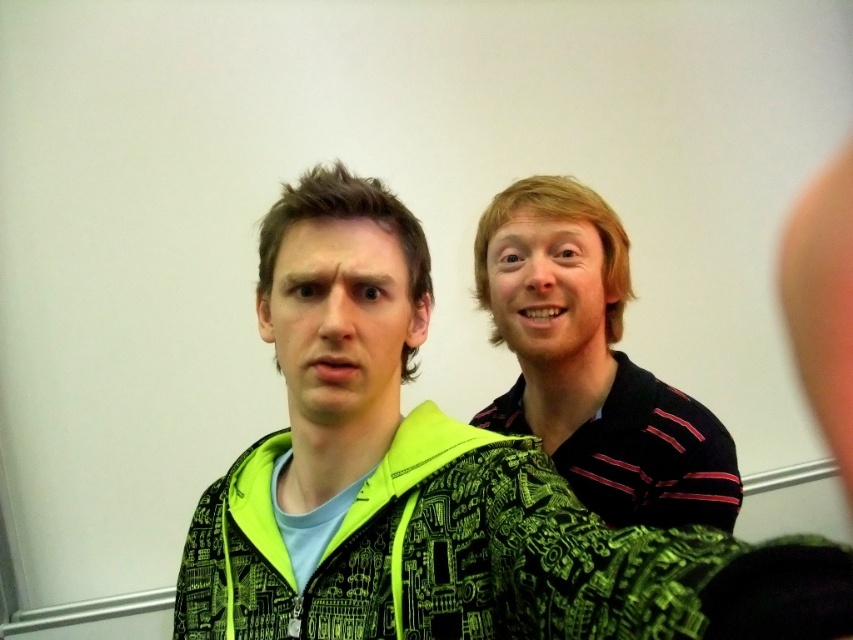
Can you confirm if striped cotton shirt at right is taller than smooth blonde hair at upper right?

Yes, striped cotton shirt at right is taller than smooth blonde hair at upper right.

Is striped cotton shirt at right to the left of smooth blonde hair at upper right from the viewer's perspective?

In fact, striped cotton shirt at right is to the right of smooth blonde hair at upper right.

What do you see at coordinates (590, 364) in the screenshot? I see `striped cotton shirt at right` at bounding box center [590, 364].

Locate an element on the screen. The image size is (853, 640). striped cotton shirt at right is located at coordinates (590, 364).

Which is in front, point (398, 272) or point (554, 332)?

Point (398, 272) is more forward.

Is point (374, 371) behind point (532, 330)?

No, it is in front of (532, 330).

Between point (328, 358) and point (570, 346), which one is positioned behind?

The point (570, 346) is behind.

The image size is (853, 640). In order to click on matte green jacket at center in this screenshot , I will do `click(340, 317)`.

Is striped cotton shirt at right further to the viewer compared to matte green jacket at center?

That is True.

Between point (502, 202) and point (403, 289), which one is positioned behind?

Point (502, 202)

The height and width of the screenshot is (640, 853). In order to click on striped cotton shirt at right in this screenshot , I will do point(590,364).